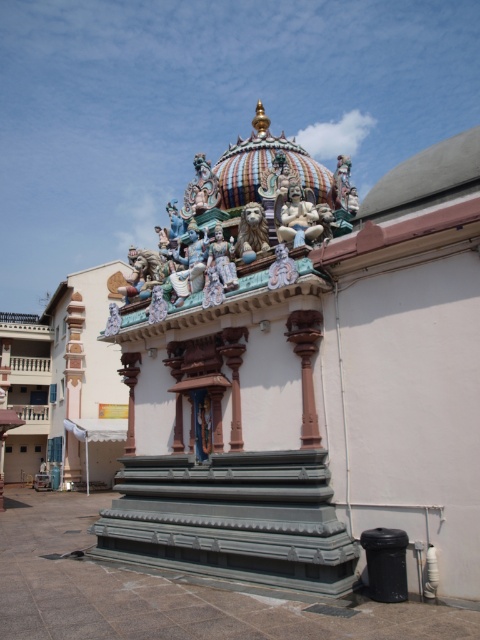
You are standing in front of the temple and want to know the distance to a specific point marked at coordinates point (312, 237). Can you estimate how far that point is from your current position?

The point (312, 237) is 36.16 meters away from the camera, so the distance from your current position to that point is approximately 36.16 meters.

You are an architect visiting this temple and want to know the spatial relationship between the polished white statue at center and the matte gold lion at center. Which one is positioned higher in the structure?

The polished white statue at center is located above the matte gold lion at center, so it is positioned higher in the structure.

You are an architect visiting the temple and want to create a scale model of the temple. You need to know which of the two central statues, the polished white statue at center or the matte gold lion at center, requires more materials due to its size. Which one should you allocate more resources to?

The polished white statue at center is larger in size than the matte gold lion at center, so you should allocate more resources to the polished white statue at center for the scale model.